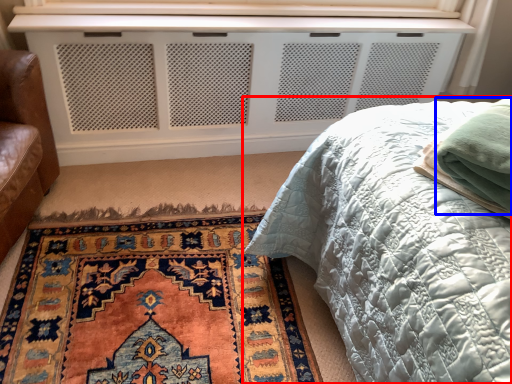
Question: Which object is further to the camera taking this photo, bed (highlighted by a red box) or material (highlighted by a blue box)?

Choices:
 (A) bed
 (B) material

Answer: (B)